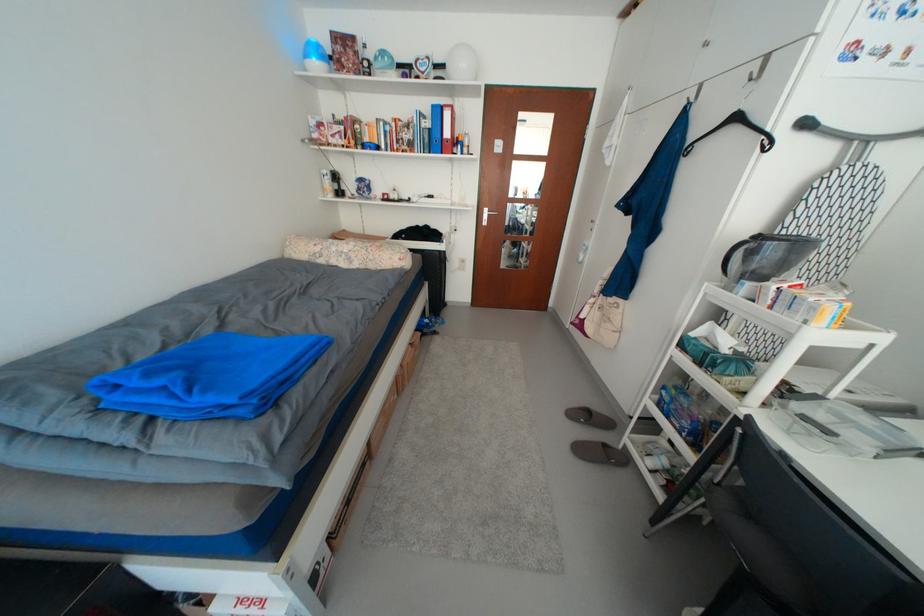
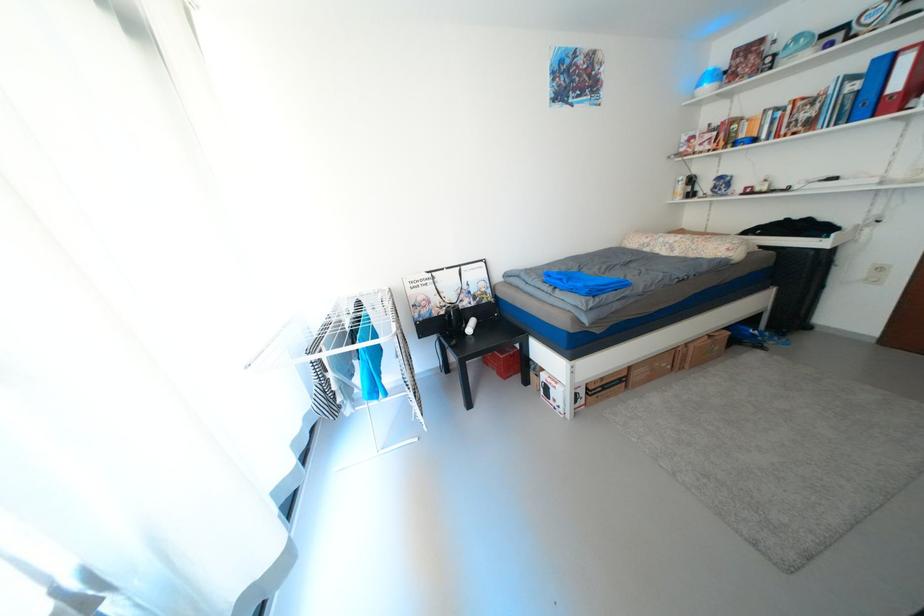
The point at (314, 58) is marked in the first image. Where is the corresponding point in the second image?

(707, 87)